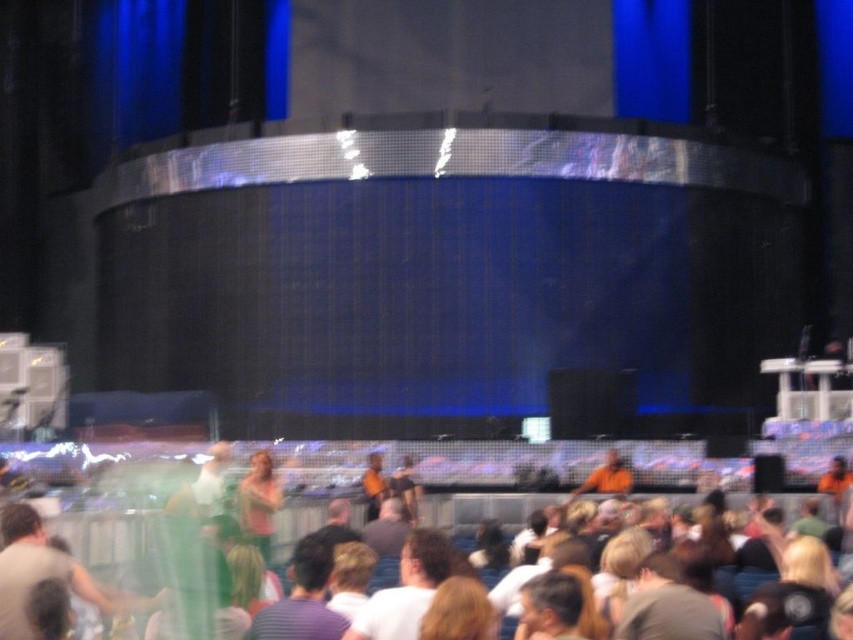
Question: Which object is positioned farthest from the green fabric dress at center?

Choices:
 (A) white cotton t-shirts at center
 (B) orange shirt at center
 (C) white t-shirt at center
 (D) striped cotton shirt at center

Answer: (C)

Question: Can you confirm if white cotton t-shirts at center is bigger than white t-shirt at center?

Choices:
 (A) yes
 (B) no

Answer: (A)

Question: Which point is farther to the camera?

Choices:
 (A) (677, 604)
 (B) (39, 449)
 (C) (378, 476)
 (D) (405, 586)

Answer: (B)

Question: Can you confirm if dark gray shirt at lower center is wider than white t-shirt at center?

Choices:
 (A) yes
 (B) no

Answer: (B)

Question: Does striped cotton shirt at center appear over green fabric dress at center?

Choices:
 (A) yes
 (B) no

Answer: (B)

Question: Which point is closer to the camera?

Choices:
 (A) orange shirt at center
 (B) green fabric dress at center

Answer: (B)